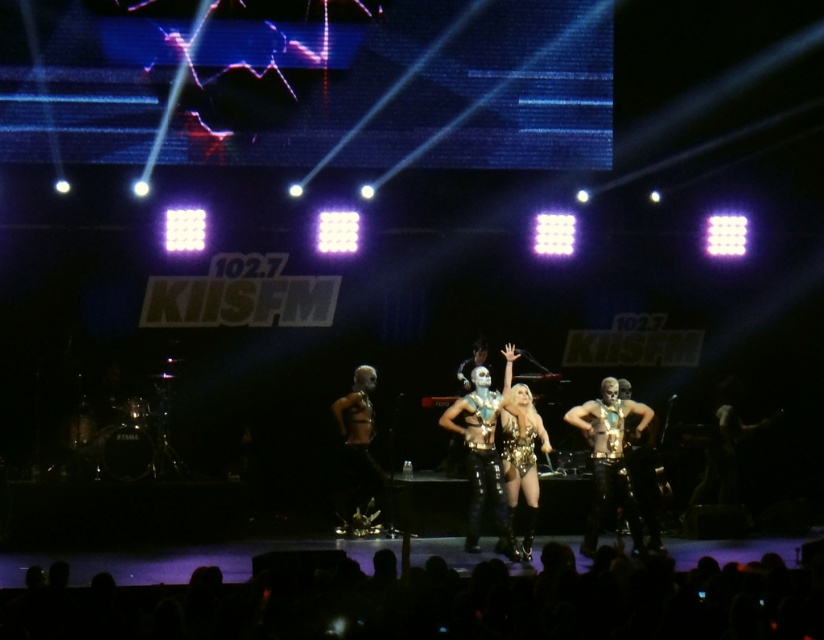
Measure the distance between gold metallic costume at center and camera.

A distance of 16.55 meters exists between gold metallic costume at center and camera.

Does gold metallic costume at center have a larger size compared to sparkly gold bodysuit at center?

Indeed, gold metallic costume at center has a larger size compared to sparkly gold bodysuit at center.

The height and width of the screenshot is (640, 824). Describe the element at coordinates (357, 444) in the screenshot. I see `gold metallic costume at center` at that location.

Where is `gold metallic costume at center`? The height and width of the screenshot is (640, 824). gold metallic costume at center is located at coordinates (357, 444).

Consider the image. Can you confirm if gold metallic suit at center is shorter than sparkly gold bodysuit at center?

Incorrect, gold metallic suit at center's height does not fall short of sparkly gold bodysuit at center's.

Image resolution: width=824 pixels, height=640 pixels. In order to click on gold metallic suit at center in this screenshot , I will do `click(609, 460)`.

Find the location of `gold metallic suit at center`. gold metallic suit at center is located at coordinates (609, 460).

Is gold metallic suit at center positioned at the back of gold metallic costume at center?

No, it is in front of gold metallic costume at center.

You are a GUI agent. You are given a task and a screenshot of the screen. Output one action in this format:
    pyautogui.click(x=<x>, y=<y>)
    Task: Click on the gold metallic suit at center
    
    Given the screenshot: What is the action you would take?
    pyautogui.click(x=609, y=460)